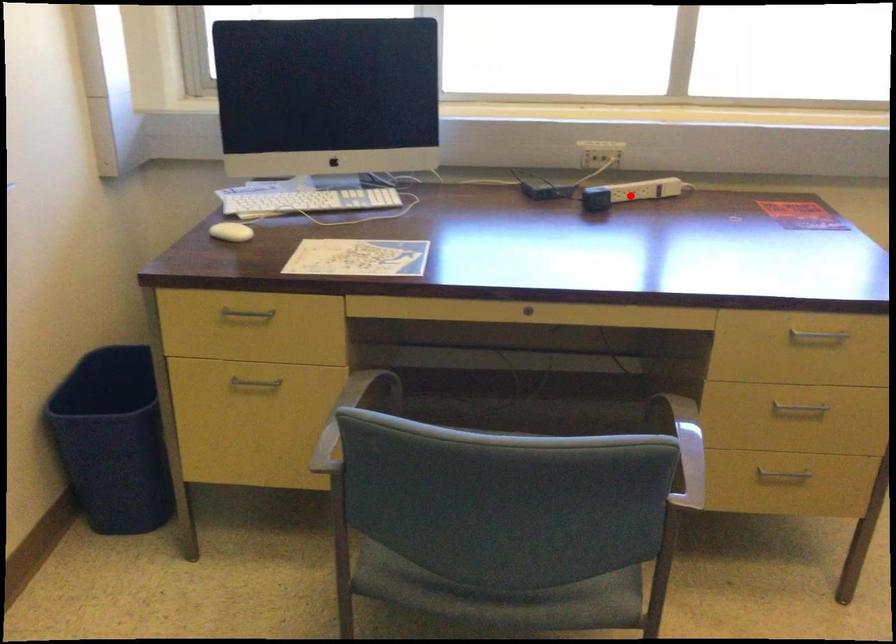
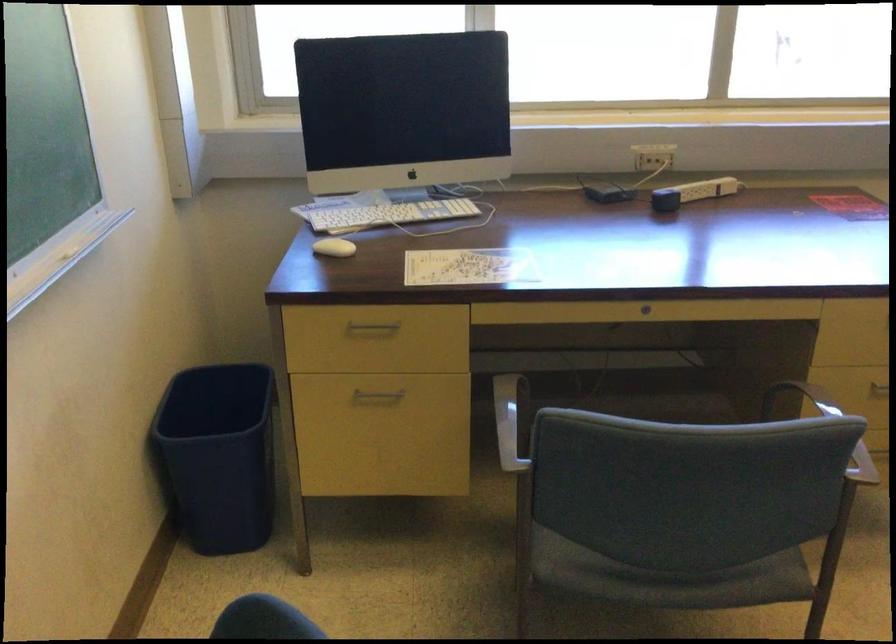
Find the pixel in the second image that matches the highlighted location in the first image.

(692, 193)